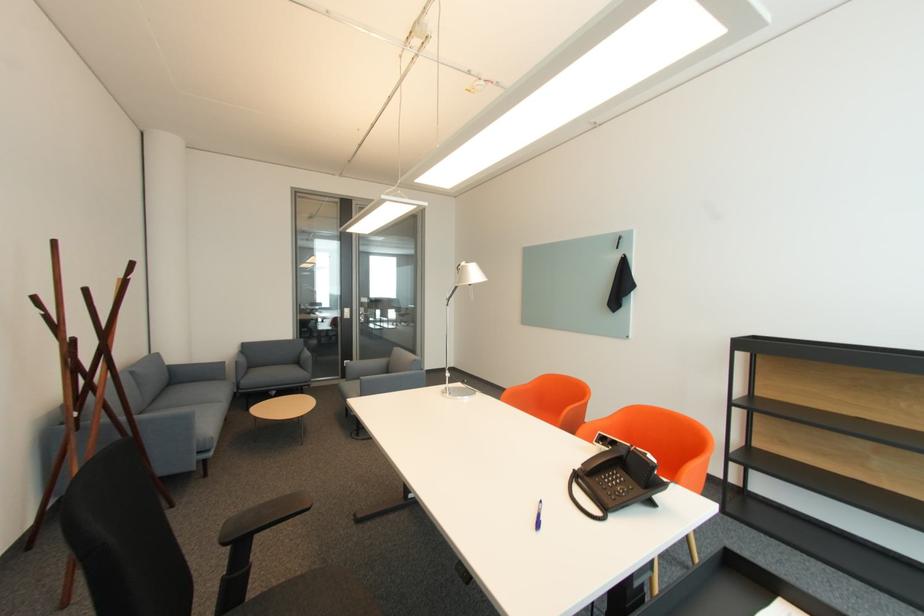
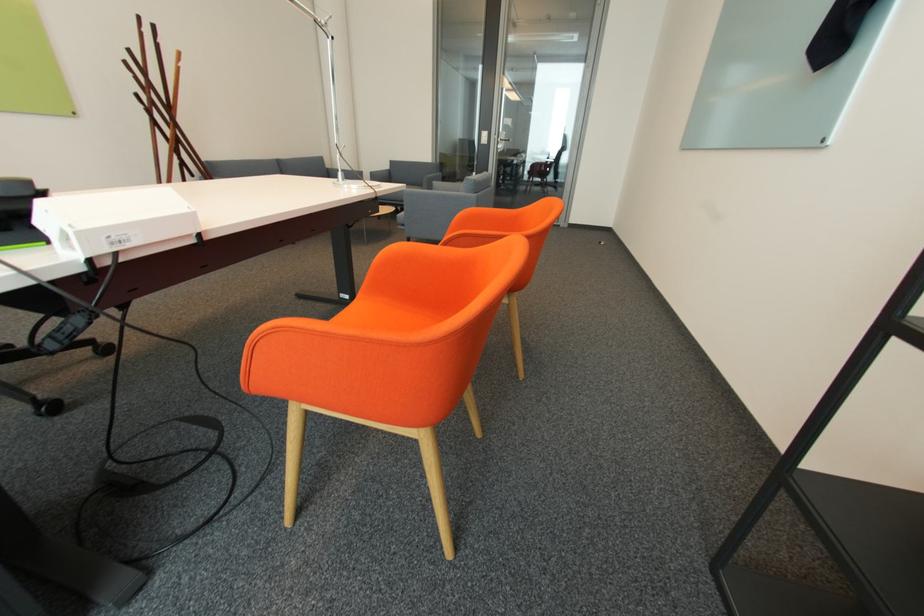
Question: I am providing you with two images of the same scene from different viewpoints. After the viewpoint changes to image2, which objects are now occluded?

Choices:
 (A) orange chair sitting surface
 (B) sofa armrest
 (C) seashell
 (D) white cable box

Answer: (B)